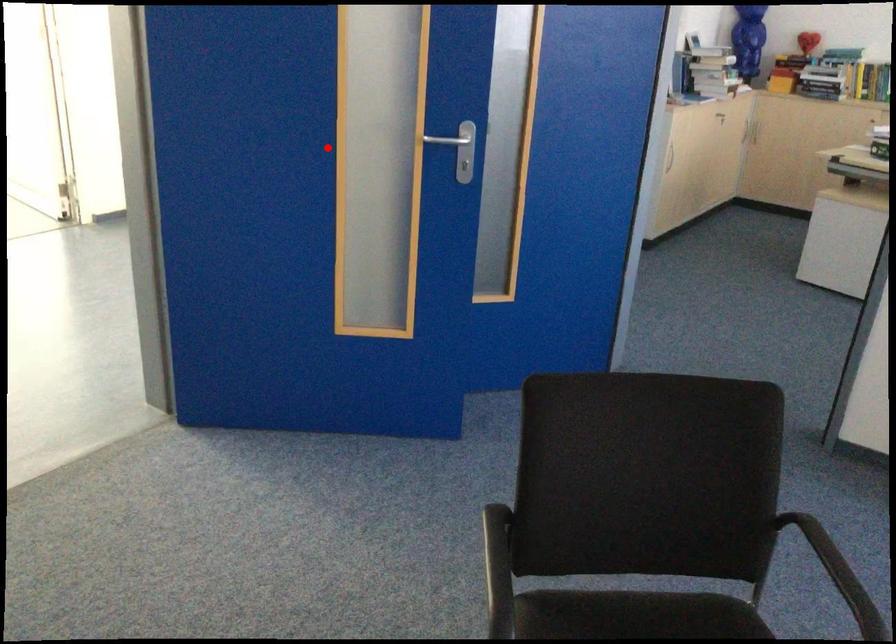
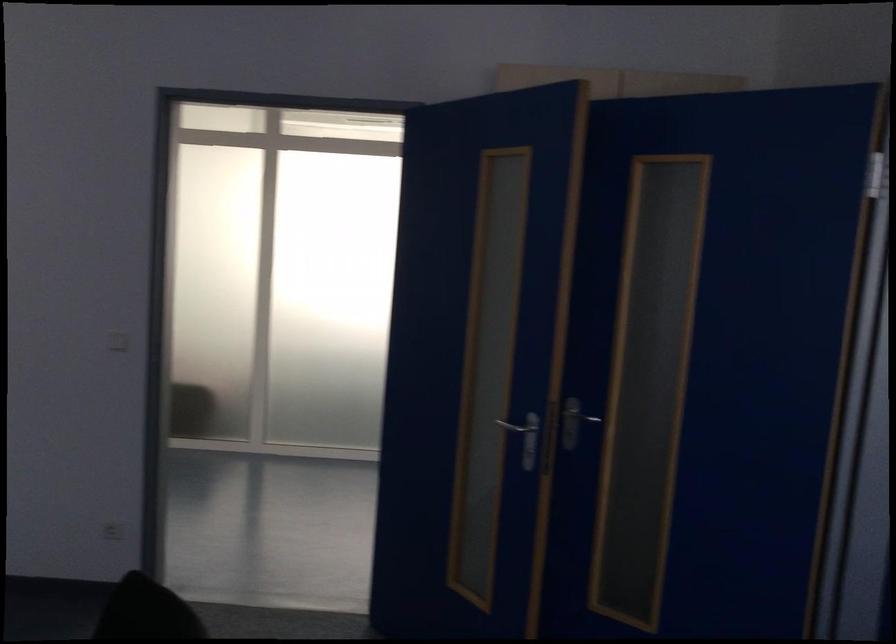
Question: I am providing you with two images of the same scene from different viewpoints. A red point is shown in image1. For the corresponding object point in image2, is it positioned nearer or farther from the camera?

Choices:
 (A) Nearer
 (B) Farther

Answer: (B)